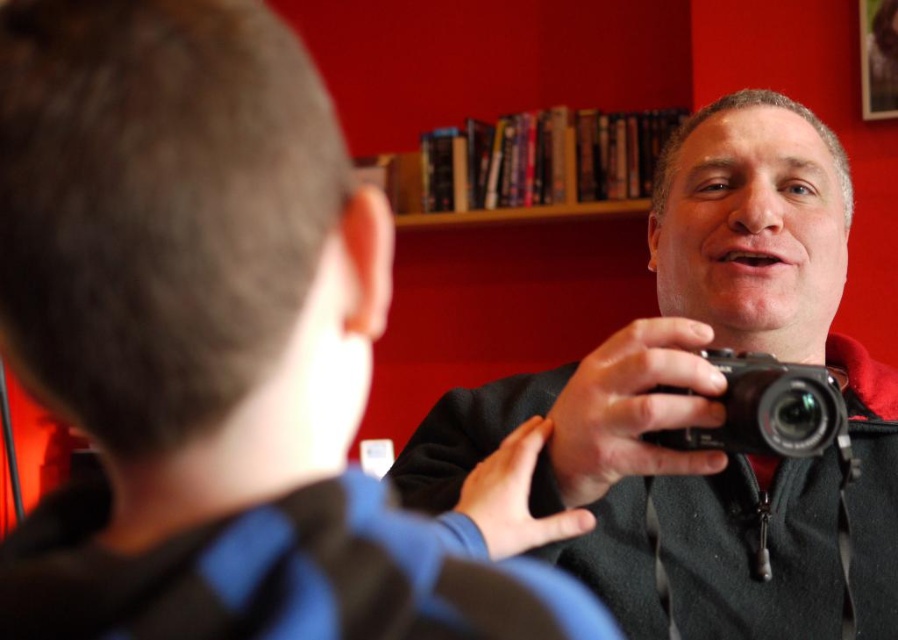
This screenshot has height=640, width=898. Describe the element at coordinates (526, 163) in the screenshot. I see `wooden bookshelf at center` at that location.

Does point (650, 163) come closer to viewer compared to point (803, 378)?

No, it is behind (803, 378).

Is point (617, 189) positioned before point (720, 401)?

No, (617, 189) is further to viewer.

The height and width of the screenshot is (640, 898). Identify the location of wooden bookshelf at center. (526, 163).

The width and height of the screenshot is (898, 640). Describe the element at coordinates (223, 353) in the screenshot. I see `smooth blue shirt at center` at that location.

Is smooth blue shirt at center closer to camera compared to black plastic camera at center?

Yes.

Between point (271, 144) and point (806, 385), which one is positioned in front?

Point (271, 144) is in front.

The image size is (898, 640). Identify the location of smooth blue shirt at center. (223, 353).

Can you confirm if smooth blue shirt at center is positioned below black matte camera at center?

Yes, smooth blue shirt at center is below black matte camera at center.

Between smooth blue shirt at center and black matte camera at center, which one is positioned lower?

smooth blue shirt at center

Does point (93, 35) come farther from viewer compared to point (773, 522)?

That is False.

Find the location of a particular element. The height and width of the screenshot is (640, 898). smooth blue shirt at center is located at coordinates (223, 353).